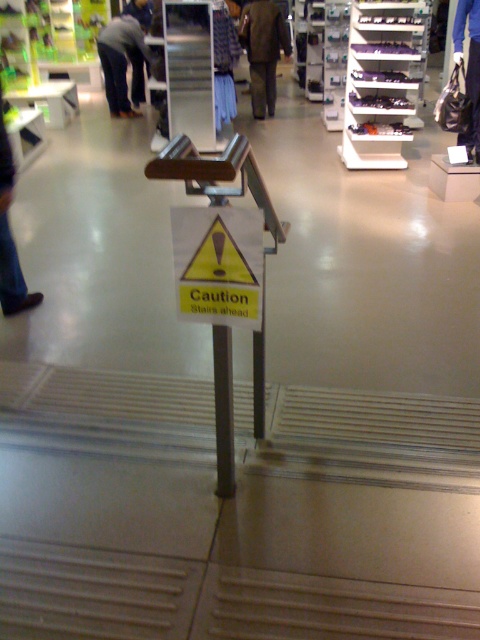
Who is shorter, yellow paper sign at center or dark gray pants at left?

yellow paper sign at center is shorter.

Identify the location of yellow paper sign at center. Image resolution: width=480 pixels, height=640 pixels. (217, 264).

Identify the location of yellow paper sign at center. (217, 264).

This screenshot has width=480, height=640. I want to click on dark gray pants at left, so click(x=123, y=61).

Is dark gray pants at left further to the viewer compared to blue jeans at center?

Yes, it is behind blue jeans at center.

Is point (142, 96) behind point (454, 49)?

That is True.

I want to click on dark gray pants at left, so click(x=123, y=61).

Can you confirm if yellow paper sign at center is wider than dark brown pants at center?

In fact, yellow paper sign at center might be narrower than dark brown pants at center.

Is yellow paper sign at center bigger than dark brown pants at center?

Actually, yellow paper sign at center might be smaller than dark brown pants at center.

Between point (188, 250) and point (256, 36), which one is positioned behind?

The point (256, 36) is more distant.

I want to click on yellow paper sign at center, so click(x=217, y=264).